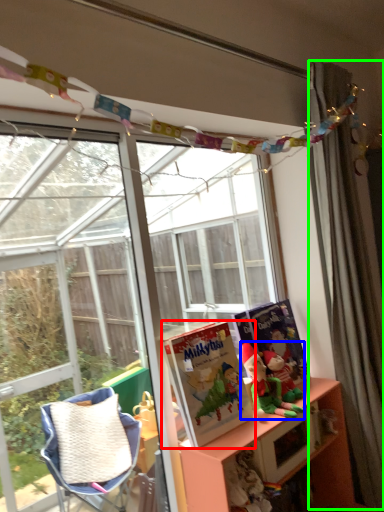
Question: Estimate the real-world distances between objects in this image. Which object is closer to book (highlighted by a red box), person (highlighted by a blue box) or curtain (highlighted by a green box)?

Choices:
 (A) person
 (B) curtain

Answer: (A)